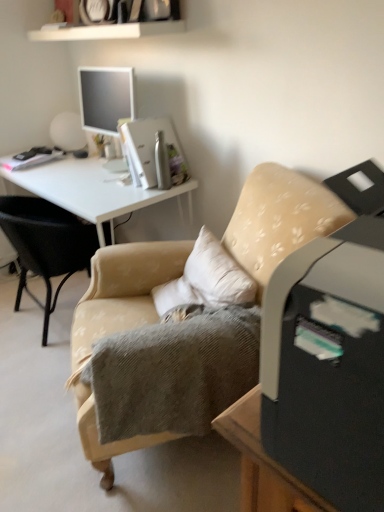
Find the location of a particular element. vacant region in front of beige fabric chair at center, which ranks as the first chair in left-to-right order is located at coordinates (31, 378).